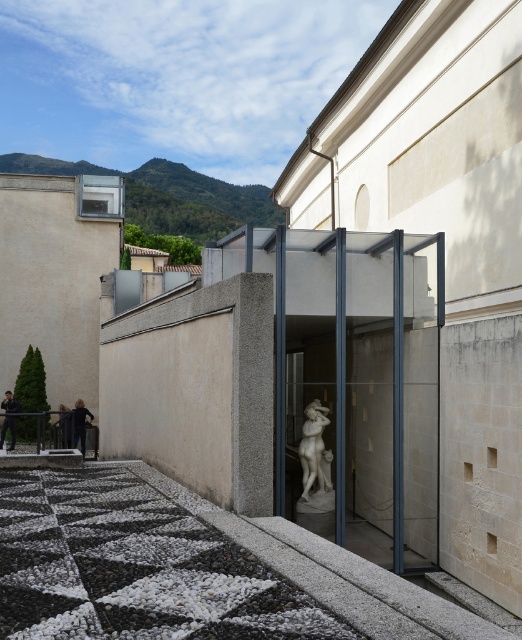
You are an art curator planning to move the dark blue fabric at lower left to the back of the polished marble statue at center. Is this possible based on their current positions?

The polished marble statue at center is currently in front of the dark blue fabric at lower left. Moving the dark blue fabric at lower left to the back of the polished marble statue at center would require placing it behind the statue, which is feasible as they are positioned in a way that allows repositioning the fabric to a location further back relative to the statue.

You are standing at the entrance of the modern architectural structure and want to take a photo of the polished marble statue at center. According to the scene description, where should you position yourself to ensure the statue is centered in your camera view?

To center the polished marble statue at center in your camera view, position yourself directly in front of the statue at its 2D location coordinates of point (314, 451) as described.